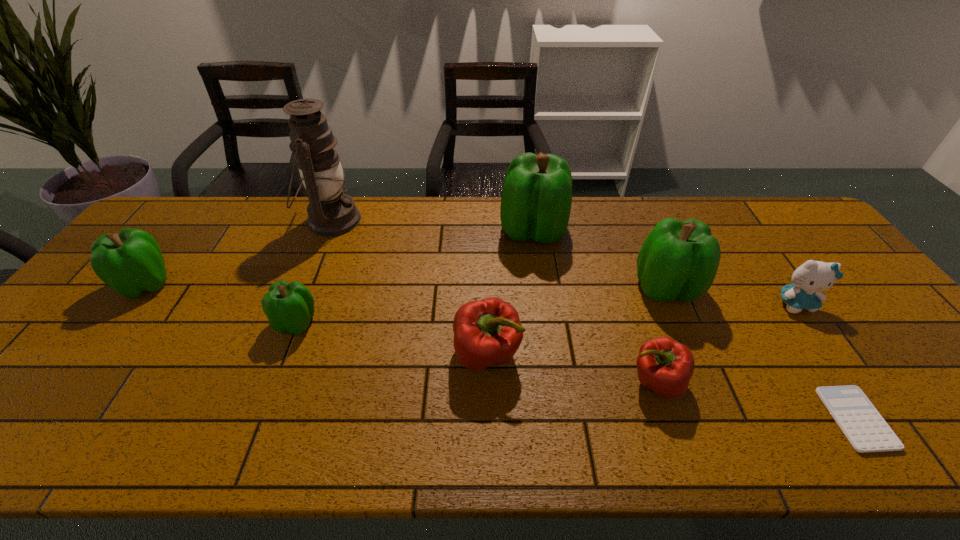
You are a GUI agent. You are given a task and a screenshot of the screen. Output one action in this format:
    pyautogui.click(x=<x>, y=<y>)
    Task: Click on the oil lamp
    The image size is (960, 540).
    Given the screenshot: What is the action you would take?
    pyautogui.click(x=330, y=212)

The width and height of the screenshot is (960, 540). Identify the location of brown oil lamp. (330, 212).

Identify the location of the farthest bell pepper. (536, 199).

Where is `the third green bell pepper from left to right`? the third green bell pepper from left to right is located at coordinates (536, 199).

You are a GUI agent. You are given a task and a screenshot of the screen. Output one action in this format:
    pyautogui.click(x=<x>, y=<y>)
    Task: Click on the fifth shortest bell pepper
    This screenshot has width=960, height=540.
    Given the screenshot: What is the action you would take?
    pyautogui.click(x=679, y=260)

Where is `the seventh shortest object`? Image resolution: width=960 pixels, height=540 pixels. the seventh shortest object is located at coordinates (679, 260).

At what (x,y) coordinates should I click in order to perform the action: click on the third biggest green bell pepper. Please return your answer as a coordinate pair (x, y). The width and height of the screenshot is (960, 540). Looking at the image, I should click on [x=130, y=262].

I want to click on the leftmost object, so click(130, 262).

At what (x,y) coordinates should I click in order to perform the action: click on the bigger pink bell pepper. Please return your answer as a coordinate pair (x, y). The width and height of the screenshot is (960, 540). Looking at the image, I should click on coord(487,332).

The image size is (960, 540). What are the coordinates of `kitten` in the screenshot? It's located at (808, 280).